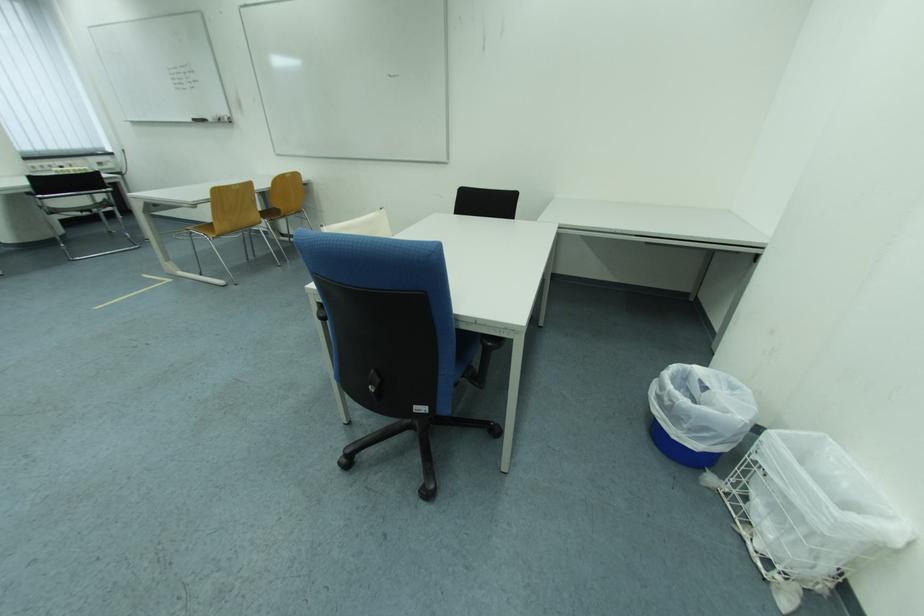
I want to click on blue trash can, so click(x=699, y=413).